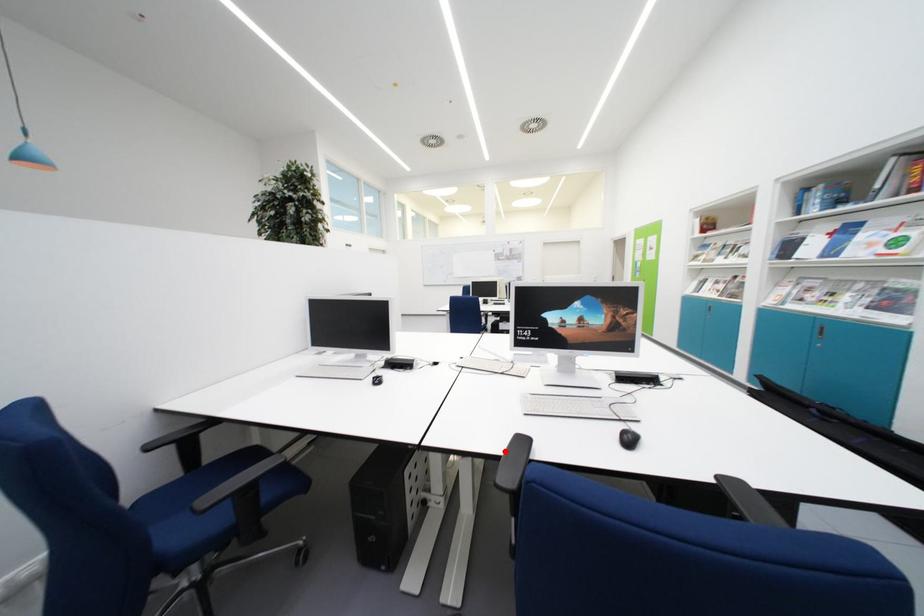
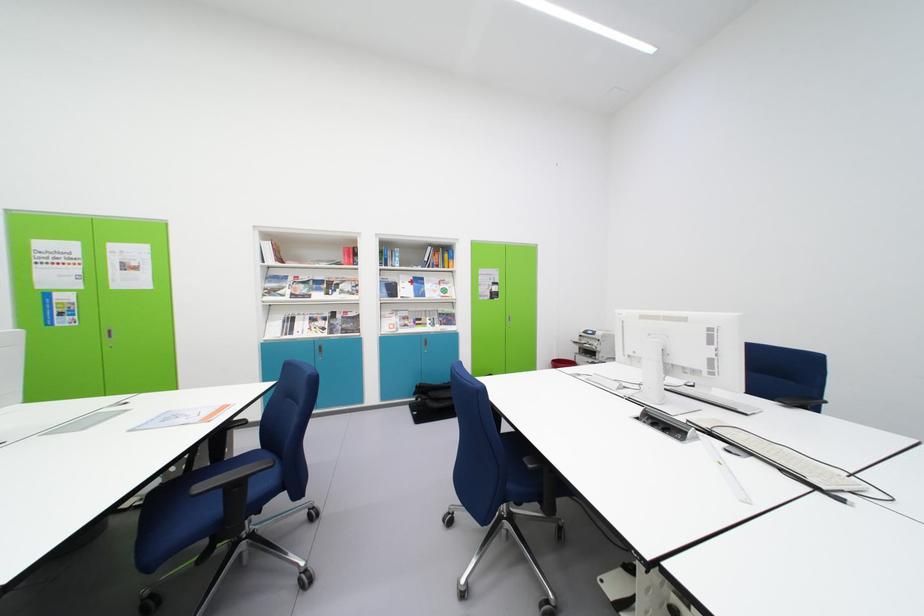
Question: I am providing you with two images of the same scene from different viewpoints. A red point is marked on the first image. Can you still see the location of the red point in image 2?

Choices:
 (A) Yes
 (B) No

Answer: (B)